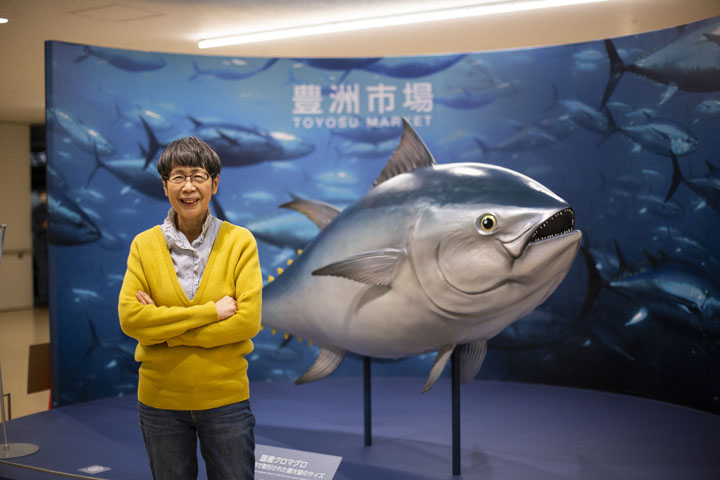
Identify the location of floor. (12, 357), (71, 433).